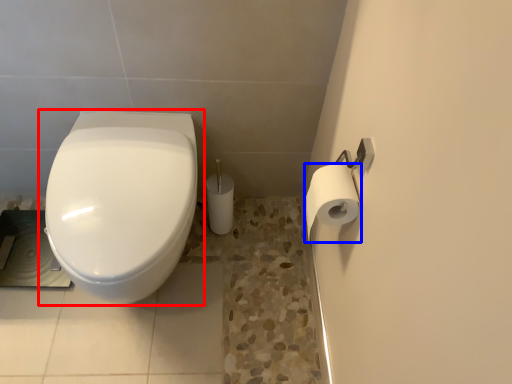
Question: Which object is closer to the camera taking this photo, toilet (highlighted by a red box) or toilet paper (highlighted by a blue box)?

Choices:
 (A) toilet
 (B) toilet paper

Answer: (B)